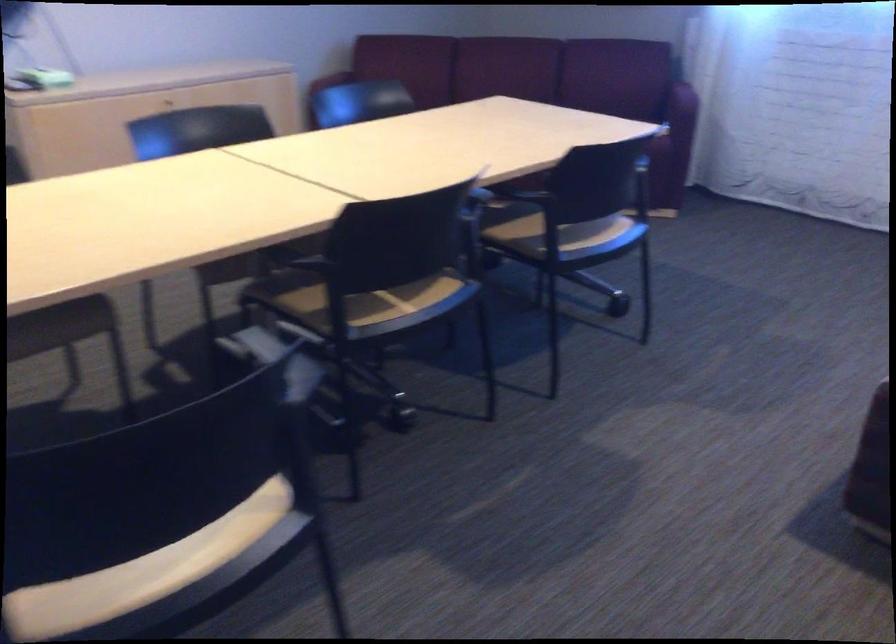
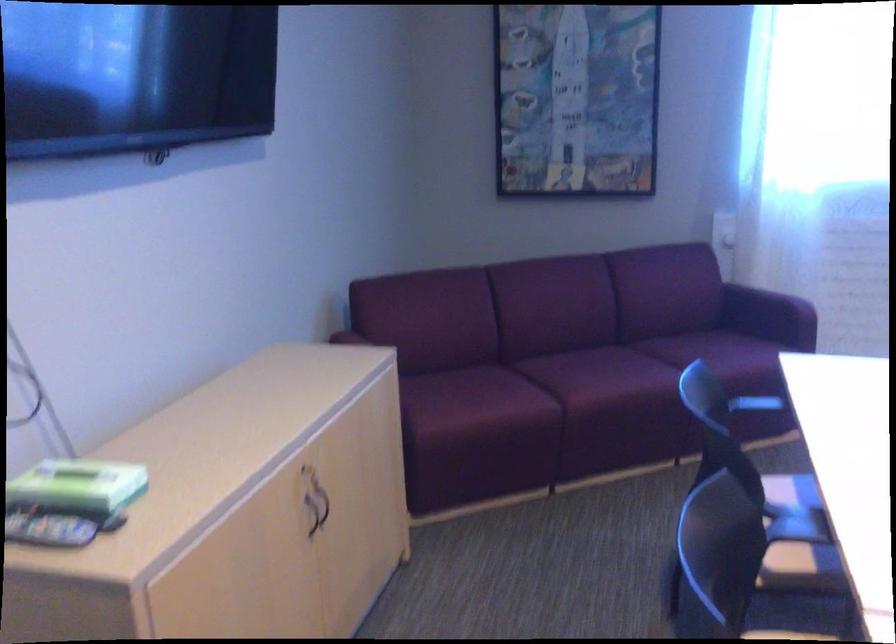
In a continuous first-person perspective shot, in which direction is the camera moving?

The cameraman walked toward left, forward.